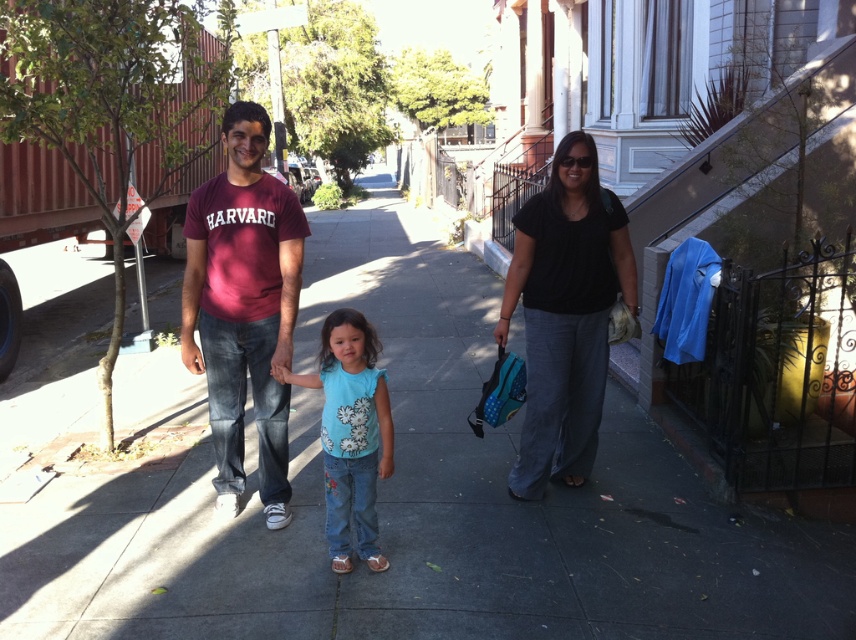
Is the position of gray concrete sidewalk at center more distant than that of maroon cotton t-shirt at center?

No, gray concrete sidewalk at center is in front of maroon cotton t-shirt at center.

The height and width of the screenshot is (640, 856). Find the location of `gray concrete sidewalk at center`. gray concrete sidewalk at center is located at coordinates (411, 502).

Which is behind, point (550, 596) or point (296, 282)?

The point (296, 282) is more distant.

I want to click on gray concrete sidewalk at center, so click(x=411, y=502).

Which of these two, black matte shirt at center or light blue denim jeans at center, stands shorter?

light blue denim jeans at center is shorter.

Does black matte shirt at center come behind light blue denim jeans at center?

That is True.

Find the location of a particular element. This screenshot has width=856, height=640. black matte shirt at center is located at coordinates (565, 314).

Based on the photo, who is more forward, (233, 442) or (609, 227)?

Point (609, 227)

Which is behind, point (276, 460) or point (550, 468)?

The point (550, 468) is more distant.

You are a GUI agent. You are given a task and a screenshot of the screen. Output one action in this format:
    pyautogui.click(x=<x>, y=<y>)
    Task: Click on the maroon cotton t-shirt at center
    The width and height of the screenshot is (856, 640).
    Given the screenshot: What is the action you would take?
    pyautogui.click(x=242, y=307)